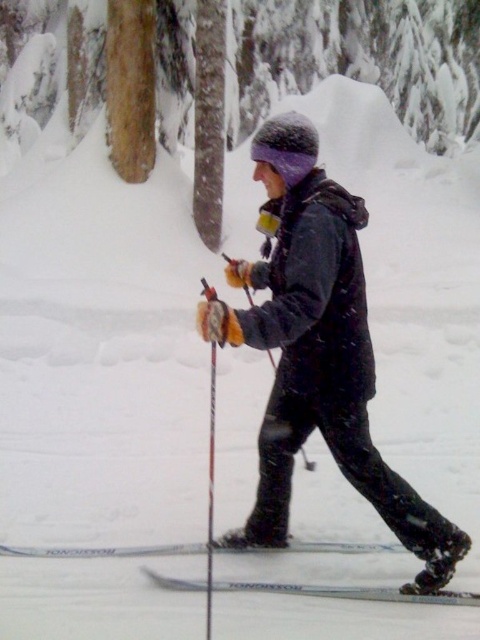
Find the location of a particular element. The height and width of the screenshot is (640, 480). brown wood tree at center is located at coordinates (361, 60).

Find the location of `brown wood tree at center`. brown wood tree at center is located at coordinates (361, 60).

Does point (285, 305) lie behind point (191, 550)?

No.

Is matte black ski pole at center to the left of silver metallic ski at lower center from the viewer's perspective?

No, matte black ski pole at center is not to the left of silver metallic ski at lower center.

Measure the distance between point (x=223, y=340) and camera.

The distance of point (x=223, y=340) from camera is 2.43 meters.

You are a GUI agent. You are given a task and a screenshot of the screen. Output one action in this format:
    pyautogui.click(x=<x>, y=<y>)
    Task: Click on the matte black ski pole at center
    The image size is (480, 640).
    Given the screenshot: What is the action you would take?
    pyautogui.click(x=317, y=352)

Can you confirm if brown wood tree at center is taller than silver metallic ski at lower center?

Yes.

Does brown wood tree at center appear over silver metallic ski at lower center?

Yes.

Is point (95, 49) behind point (420, 598)?

Yes, point (95, 49) is behind point (420, 598).

I want to click on brown wood tree at center, so click(361, 60).